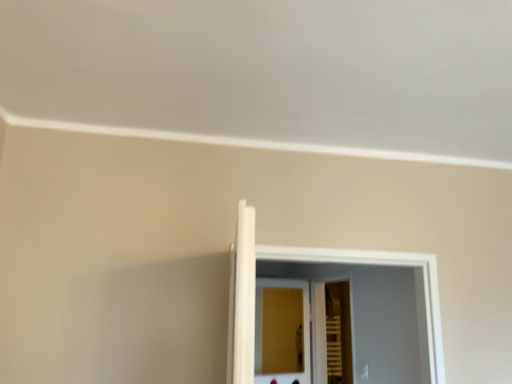
Question: Is point (331, 296) closer or farther from the camera than point (306, 289)?

Choices:
 (A) farther
 (B) closer

Answer: (A)

Question: From the image's perspective, relative to wooden screen door at center, marked as the first screen door in a left-to-right arrangement, is wooden slats at center, the 2th screen door positioned from the left, above or below?

Choices:
 (A) below
 (B) above

Answer: (B)

Question: Based on their sizes in the image, would you say wooden slats at center, which is the 1th screen door in right-to-left order, is bigger or smaller than wooden screen door at center, which appears as the 2th screen door when viewed from the right?

Choices:
 (A) small
 (B) big

Answer: (B)

Question: Considering the positions of wooden screen door at center, marked as the first screen door in a left-to-right arrangement, and wooden slats at center, the 2th screen door positioned from the left, in the image, is wooden screen door at center, marked as the first screen door in a left-to-right arrangement, wider or thinner than wooden slats at center, the 2th screen door positioned from the left,?

Choices:
 (A) wide
 (B) thin

Answer: (B)

Question: From a real-world perspective, relative to wooden slats at center, which is the 1th screen door in right-to-left order, is wooden screen door at center, which appears as the 2th screen door when viewed from the right, vertically above or below?

Choices:
 (A) below
 (B) above

Answer: (A)

Question: Considering the positions of wooden screen door at center, marked as the first screen door in a left-to-right arrangement, and wooden slats at center, the 2th screen door positioned from the left, in the image, is wooden screen door at center, marked as the first screen door in a left-to-right arrangement, taller or shorter than wooden slats at center, the 2th screen door positioned from the left,?

Choices:
 (A) short
 (B) tall

Answer: (A)

Question: Considering their positions, is wooden screen door at center, marked as the first screen door in a left-to-right arrangement, located in front of or behind wooden slats at center, which is the 1th screen door in right-to-left order?

Choices:
 (A) front
 (B) behind

Answer: (B)